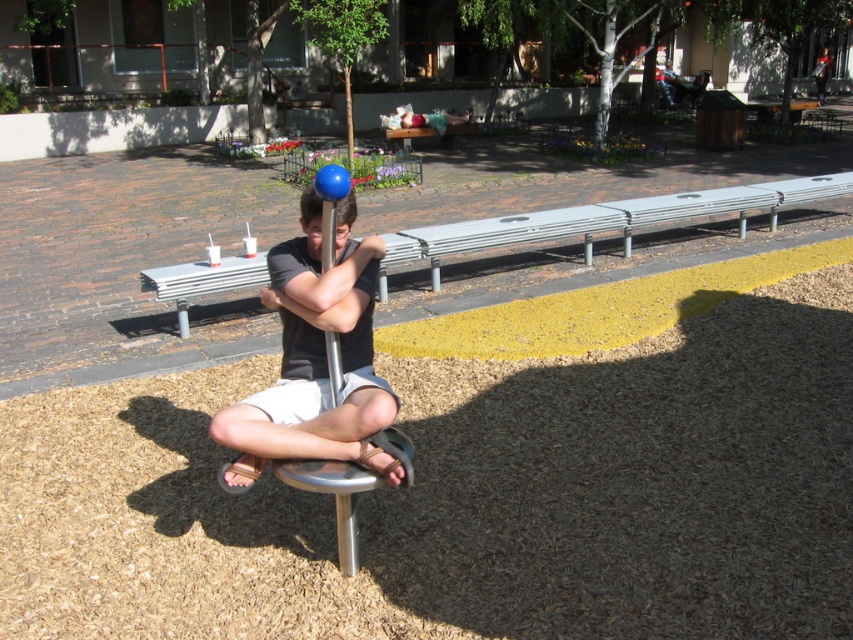
You are standing in the park and want to walk from point A to point B. Point A is at coordinates point (431, 273) and point B is at coordinates point (329, 196). Which point is closer to you when you start walking?

Point (431, 273) is further to the viewer than point (329, 196), so point B is closer to you when you start walking.

You are a park maintenance worker who needs to place a new bench that is 2 meters wide in the same area. Given the current metallic silver bench at center and blue glossy pole at center, which object would you need to consider for space availability?

The metallic silver bench at center has a width less than the blue glossy pole at center, so you should consider the blue glossy pole at center for space availability since it is wider and may require more clearance.

You are standing in the park and want to take a photo of both the point at (248, 420) and the point at (733, 188). Which point should you focus on first to ensure both are in focus?

You should focus on the point at (248, 420) first because it is closer to the camera, ensuring both points will be in focus when using depth of field.